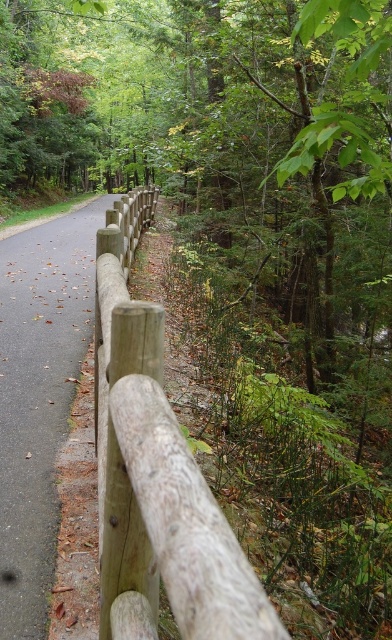
Question: Which point appears closest to the camera in this image?

Choices:
 (A) (59, 340)
 (B) (181, 576)

Answer: (B)

Question: Is wooden fence at center closer to the viewer compared to smooth wooden fence at center?

Choices:
 (A) no
 (B) yes

Answer: (B)

Question: Does wooden fence at center have a greater width compared to smooth wooden fence at center?

Choices:
 (A) no
 (B) yes

Answer: (A)

Question: Can you confirm if wooden fence at center is positioned to the right of smooth wooden fence at center?

Choices:
 (A) yes
 (B) no

Answer: (A)